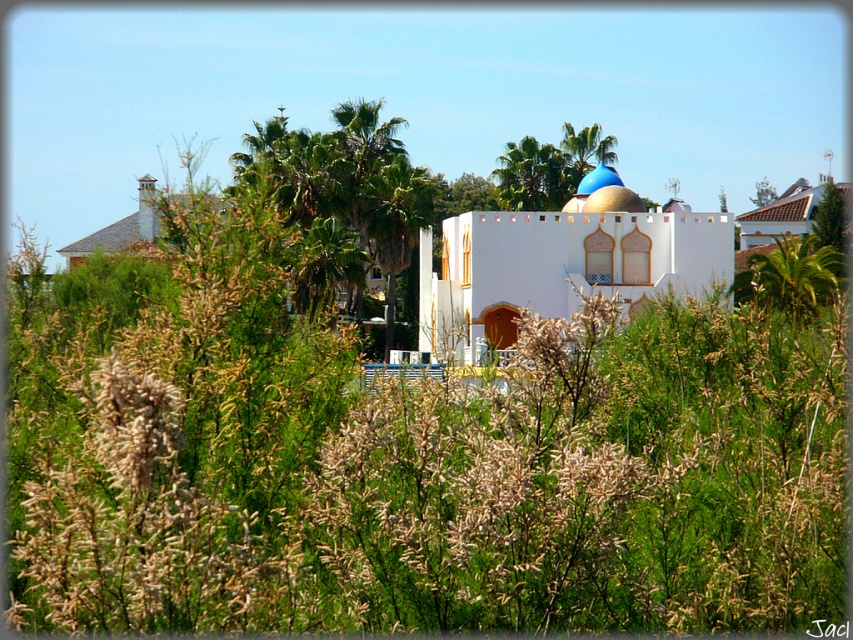
From the picture: Who is shorter, white matte building at center or blue glossy dome at upper center?

Standing shorter between the two is blue glossy dome at upper center.

Looking at this image, does white matte building at center appear under blue glossy dome at upper center?

Yes.

Between point (581, 204) and point (602, 173), which one is positioned in front?

Positioned in front is point (602, 173).

At what (x,y) coordinates should I click in order to perform the action: click on white matte building at center. Please return your answer as a coordinate pair (x, y). Looking at the image, I should click on (561, 262).

The image size is (853, 640). I want to click on white matte building at center, so click(x=561, y=262).

Who is more forward, (463, 305) or (549, 148)?

Point (463, 305)

Is point (434, 289) farther from camera compared to point (503, 160)?

No, (434, 289) is closer to viewer.

Identify the location of white matte building at center. (561, 262).

Which is in front, point (511, 200) or point (611, 168)?

Point (611, 168)

Which is more to the left, green leafy palm tree at upper center or blue glossy dome at upper center?

From the viewer's perspective, green leafy palm tree at upper center appears more on the left side.

Between point (521, 147) and point (604, 205), which one is positioned behind?

Point (521, 147)

At what (x,y) coordinates should I click in order to perform the action: click on green leafy palm tree at upper center. Please return your answer as a coordinate pair (x, y). Image resolution: width=853 pixels, height=640 pixels. Looking at the image, I should click on (531, 176).